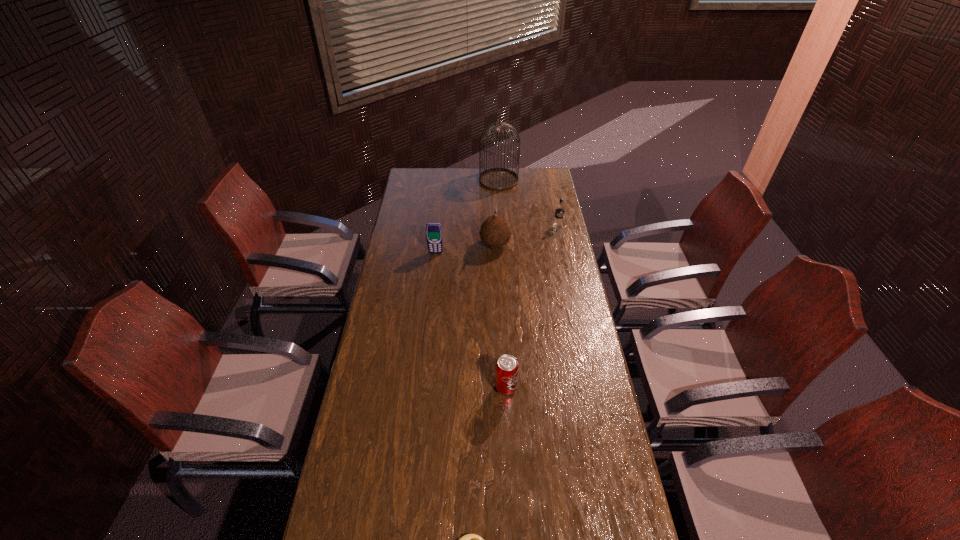
This screenshot has height=540, width=960. What are the coordinates of `free space in the image that satisfies the following two spatial constraints: 1. on the front-facing side of the second nearest object; 2. on the right side of the leftmost object` in the screenshot? It's located at (420, 388).